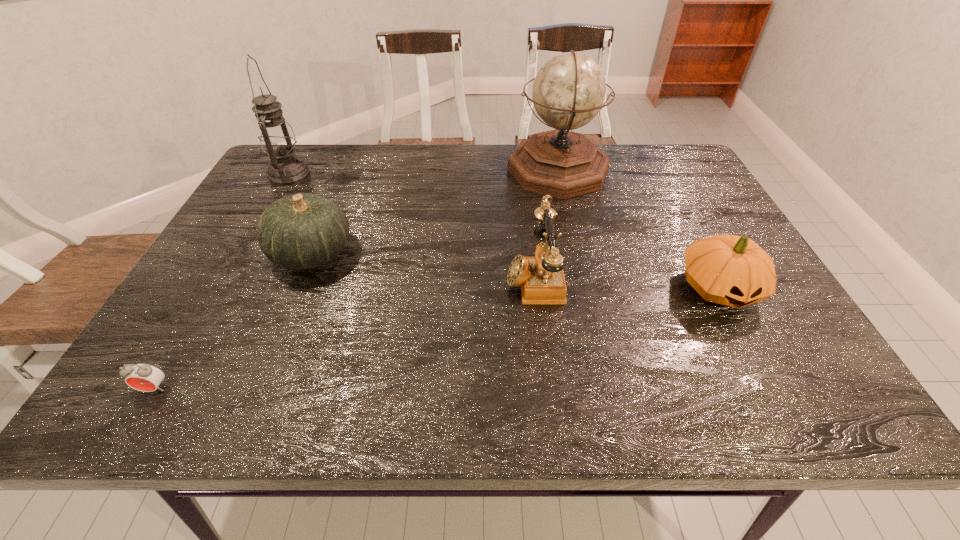
At what (x,y) coordinates should I click in order to perform the action: click on globe. Please return your answer as a coordinate pair (x, y). The width and height of the screenshot is (960, 540). Looking at the image, I should click on (569, 90).

The width and height of the screenshot is (960, 540). Find the location of `oil lamp`. oil lamp is located at coordinates (277, 138).

Identify the location of telephone. (541, 278).

Locate an element on the screen. The height and width of the screenshot is (540, 960). the left gourd is located at coordinates (301, 231).

Identify the location of the rightmost object. (731, 270).

Locate an element on the screen. the nearest object is located at coordinates click(144, 377).

Where is `alarm clock`? alarm clock is located at coordinates (144, 377).

Locate an element on the screen. This screenshot has height=540, width=960. free point located 0.130m on the surface of the globe is located at coordinates coord(464,170).

You are a GUI agent. You are given a task and a screenshot of the screen. Output one action in this format:
    pyautogui.click(x=<x>, y=<y>)
    Task: Click on the vacant position located 0.080m on the surface of the globe
    
    Given the screenshot: What is the action you would take?
    pyautogui.click(x=481, y=170)

The width and height of the screenshot is (960, 540). What are the coordinates of `free space located on the surface of the globe` in the screenshot? It's located at (450, 170).